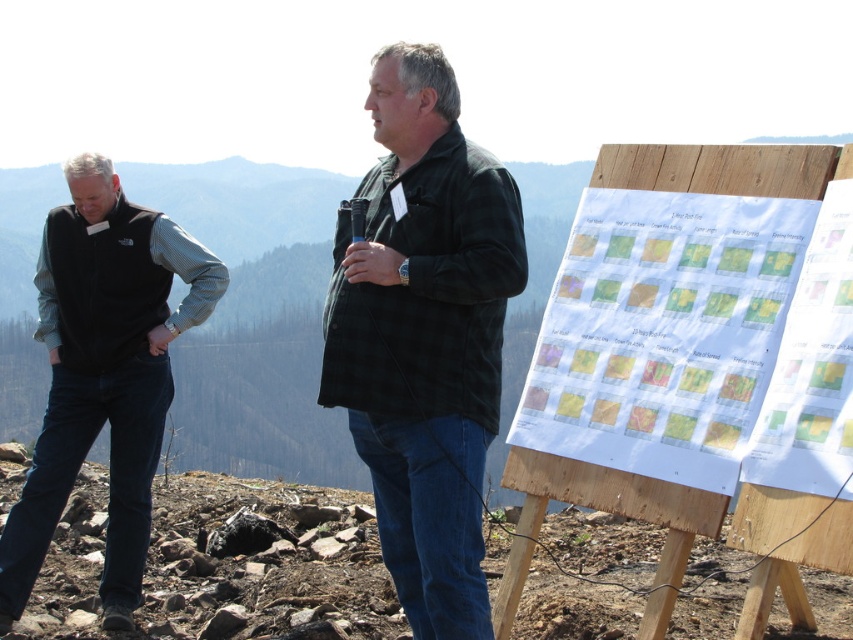
You are a photographer planning to take a picture of the black fleece vest at left and the wooden at right. Which object should you focus on first if you want to capture both in the frame without moving the camera?

The black fleece vest at left is positioned on the left side of wooden at right, so you should focus on the black fleece vest at left first to ensure both are in frame without moving the camera.

You are a photographer planning to take a portrait of both individuals. You want to ensure that the black corduroy jacket at center and the black fleece vest at left are both clearly visible in the frame. Based on their positions, which one should you focus on first to ensure proper focus?

The black corduroy jacket at center is located above the black fleece vest at left, so you should focus on the black corduroy jacket at center first to ensure proper focus since it is closer to the camera.